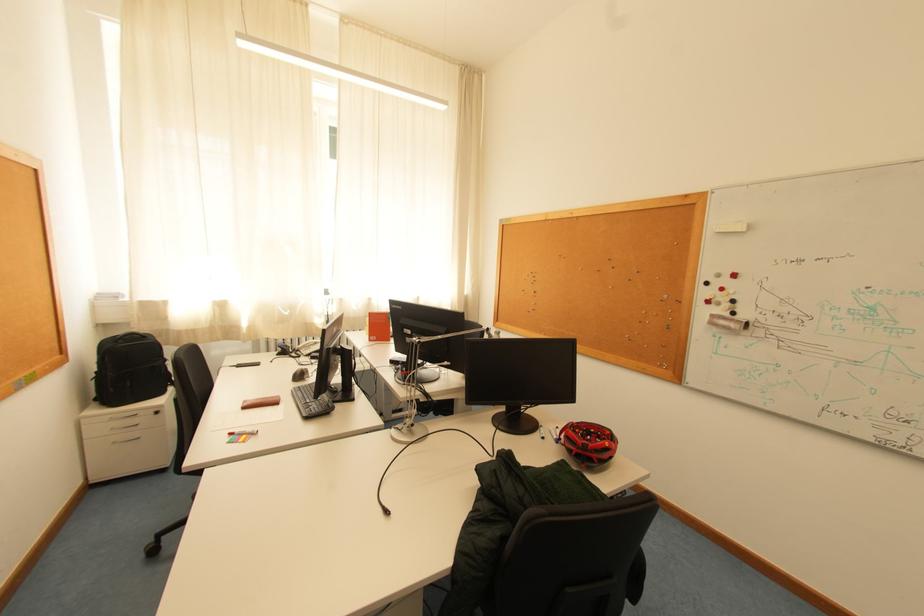
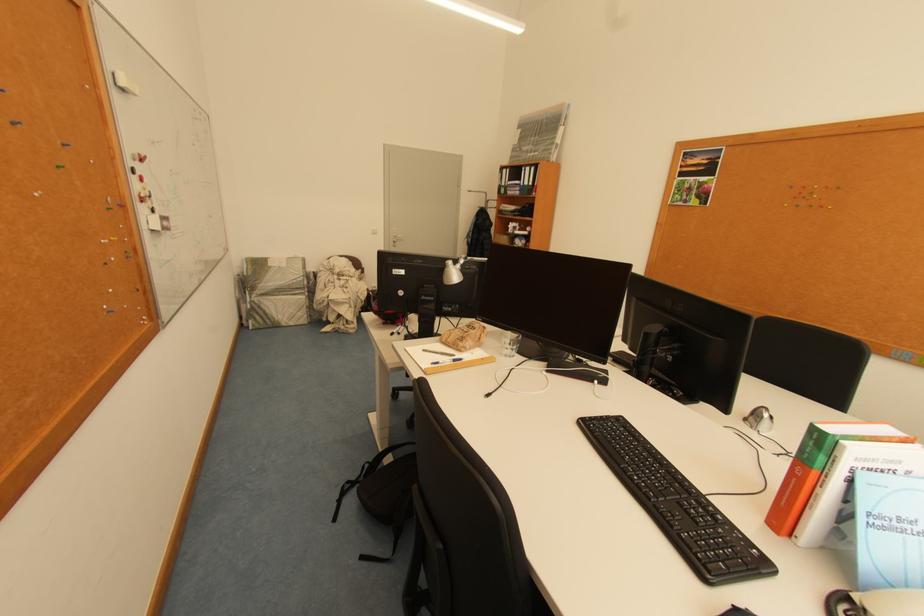
The point at (714, 285) is marked in the first image. Where is the corresponding point in the second image?

(141, 172)